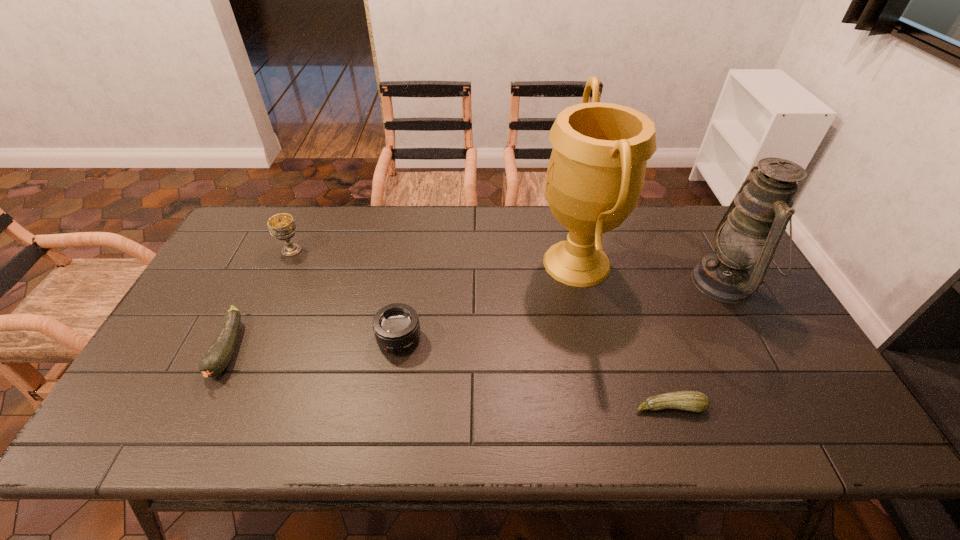
I want to click on trophy, so click(596, 172).

The image size is (960, 540). In order to click on oil lamp in this screenshot , I will do `click(750, 230)`.

Locate an element on the screen. The width and height of the screenshot is (960, 540). the rightmost object is located at coordinates (750, 230).

You are a GUI agent. You are given a task and a screenshot of the screen. Output one action in this format:
    pyautogui.click(x=<x>, y=<y>)
    Task: Click on the fourth shortest object
    The width and height of the screenshot is (960, 540).
    Given the screenshot: What is the action you would take?
    pyautogui.click(x=282, y=226)

At what (x,y) coordinates should I click in order to perform the action: click on telephoto lens. Please return your answer as a coordinate pair (x, y). This screenshot has width=960, height=540. Looking at the image, I should click on (396, 327).

At what (x,y) coordinates should I click in order to perform the action: click on the fourth object from right to left. Please return your answer as a coordinate pair (x, y). This screenshot has width=960, height=540. Looking at the image, I should click on (396, 327).

You are a GUI agent. You are given a task and a screenshot of the screen. Output one action in this format:
    pyautogui.click(x=<x>, y=<y>)
    Task: Click on the left zucchini
    The width and height of the screenshot is (960, 540).
    Given the screenshot: What is the action you would take?
    pyautogui.click(x=216, y=359)

This screenshot has width=960, height=540. I want to click on the farther zucchini, so click(216, 359).

At what (x,y) coordinates should I click in order to perform the action: click on the nearer zucchini. Please return your answer as a coordinate pair (x, y). The width and height of the screenshot is (960, 540). Looking at the image, I should click on (694, 401).

I want to click on the shortest object, so click(694, 401).